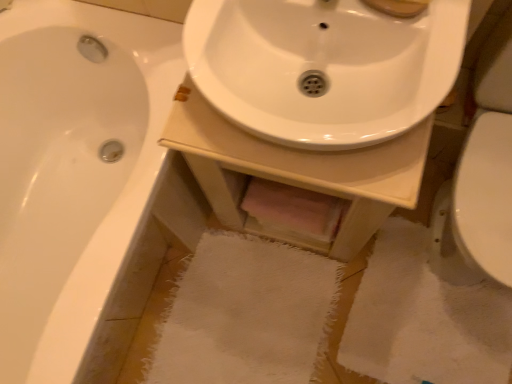
Question: Is white glossy sink at center taller than white glossy sink at center?

Choices:
 (A) no
 (B) yes

Answer: (B)

Question: From the image's perspective, is white glossy sink at center over white glossy sink at center?

Choices:
 (A) no
 (B) yes

Answer: (A)

Question: Is white glossy sink at center oriented away from white glossy sink at center?

Choices:
 (A) yes
 (B) no

Answer: (B)

Question: Considering the relative sizes of white glossy sink at center and white glossy sink at center in the image provided, is white glossy sink at center thinner than white glossy sink at center?

Choices:
 (A) no
 (B) yes

Answer: (A)

Question: Can you confirm if white glossy sink at center is bigger than white glossy sink at center?

Choices:
 (A) no
 (B) yes

Answer: (B)

Question: Considering the relative positions of white glossy sink at center and white glossy sink at center in the image provided, is white glossy sink at center to the left of white glossy sink at center from the viewer's perspective?

Choices:
 (A) no
 (B) yes

Answer: (A)

Question: Considering the relative positions of white glossy sink at center and white glossy bathtub at left in the image provided, is white glossy sink at center to the left of white glossy bathtub at left from the viewer's perspective?

Choices:
 (A) yes
 (B) no

Answer: (B)

Question: Considering the relative sizes of white glossy sink at center and white glossy bathtub at left in the image provided, is white glossy sink at center thinner than white glossy bathtub at left?

Choices:
 (A) yes
 (B) no

Answer: (A)

Question: Does white glossy sink at center lie behind white glossy bathtub at left?

Choices:
 (A) no
 (B) yes

Answer: (A)

Question: Is white glossy sink at center turned away from white glossy bathtub at left?

Choices:
 (A) no
 (B) yes

Answer: (A)

Question: Is white glossy sink at center aimed at white glossy bathtub at left?

Choices:
 (A) no
 (B) yes

Answer: (A)

Question: Can you confirm if white glossy sink at center is smaller than white glossy bathtub at left?

Choices:
 (A) yes
 (B) no

Answer: (A)

Question: From the image's perspective, is white glossy sink at center on white glossy sink at center?

Choices:
 (A) no
 (B) yes

Answer: (B)